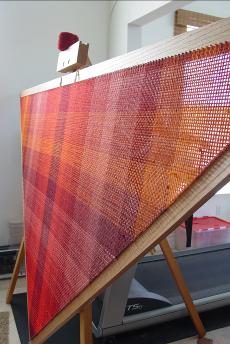
Find the location of `white painted walls`. white painted walls is located at coordinates (116, 38), (147, 35), (38, 32).